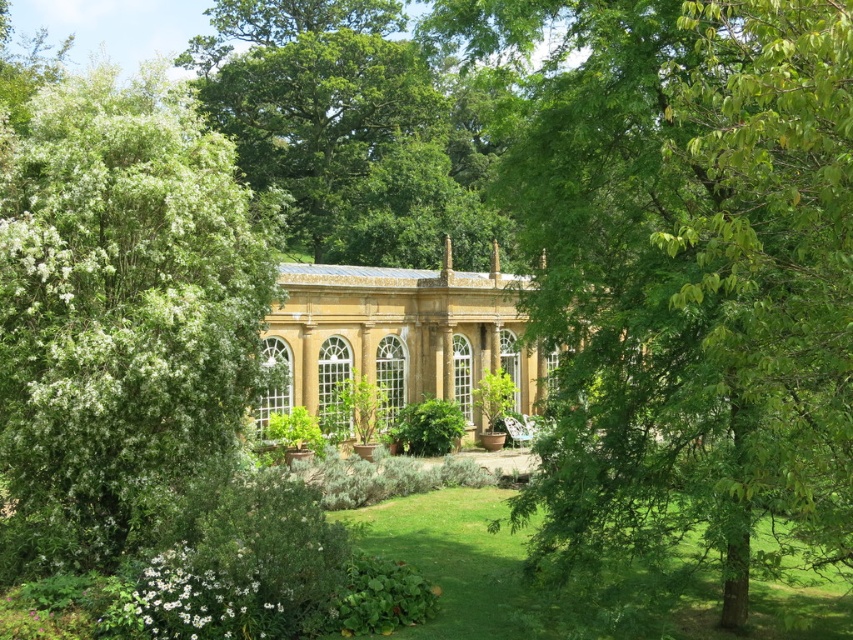
You are planning to install a small garden bench between the green leafy tree at center and the green leafy tree at left. The bench requires a minimum of 10 meters of space between the two trees to be placed comfortably. Based on the scene, is this possible?

The green leafy tree at center and green leafy tree at left are 12.46 meters apart, which is more than the required 10 meters. Therefore, the bench can be comfortably placed between them.

You are standing in the garden and want to walk from the green leafy tree at left to the golden stone palace at center. Which direction should you move towards?

You should move towards the right direction because the green leafy tree at left is positioned on the left side of the golden stone palace at center.